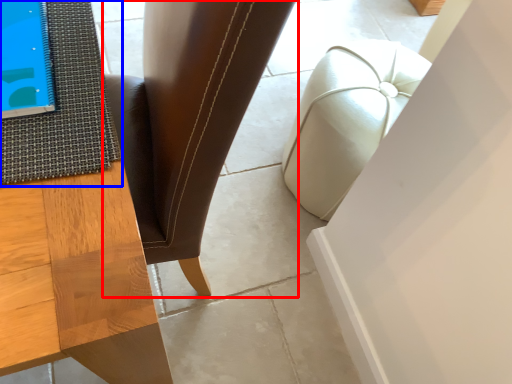
Question: Which point is closer to the camera, chair (highlighted by a red box) or mat (highlighted by a blue box)?

Choices:
 (A) chair
 (B) mat

Answer: (A)